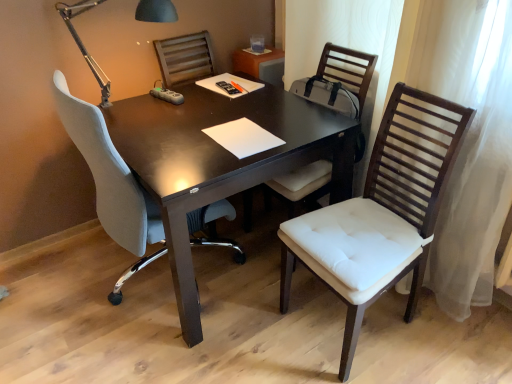
Find the location of `vacant region to the left of white padded chair at right, the 3th chair from the left`. vacant region to the left of white padded chair at right, the 3th chair from the left is located at coordinates pos(265,347).